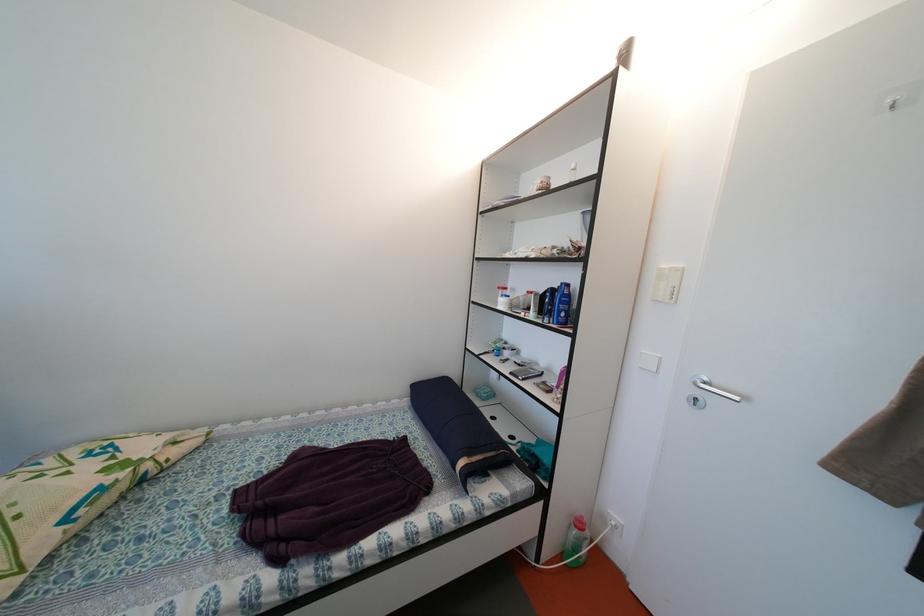
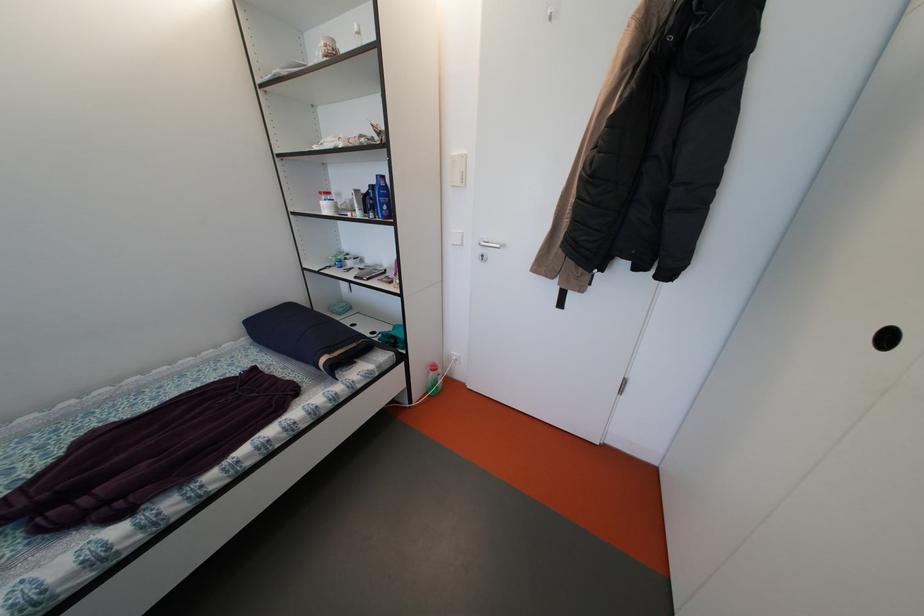
The point at [587,530] is marked in the first image. Where is the corresponding point in the second image?

(441, 373)